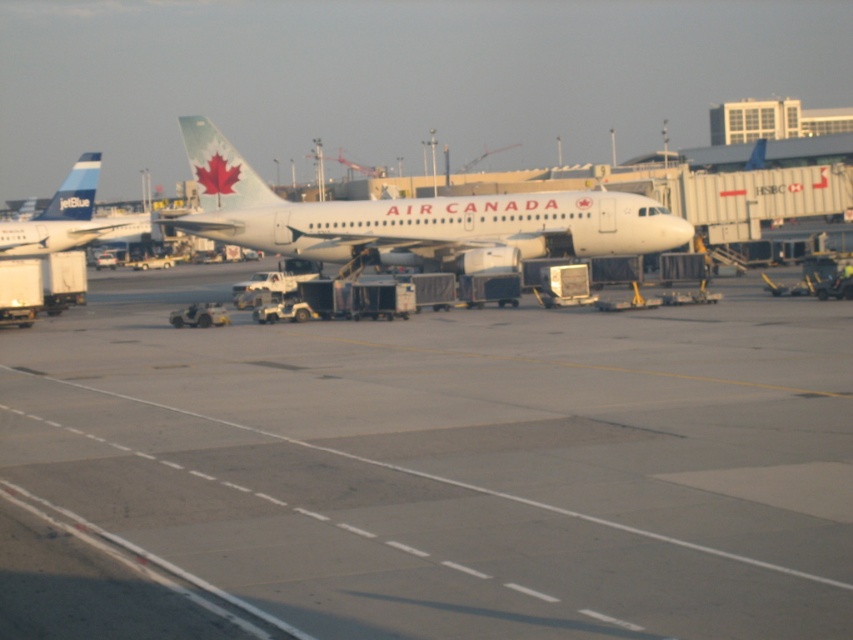
Question: Is white matte airplane at center smaller than matte blue airplane at left?

Choices:
 (A) no
 (B) yes

Answer: (A)

Question: Among these points, which one is nearest to the camera?

Choices:
 (A) (4, 234)
 (B) (640, 490)
 (C) (520, 224)

Answer: (B)

Question: Which point is closer to the camera?

Choices:
 (A) matte blue airplane at left
 (B) gray concrete tarmac at center

Answer: (B)

Question: Does gray concrete tarmac at center appear on the right side of matte blue airplane at left?

Choices:
 (A) yes
 (B) no

Answer: (A)

Question: Which point is closer to the camera taking this photo?

Choices:
 (A) (56, 212)
 (B) (90, 392)

Answer: (B)

Question: Considering the relative positions of white matte airplane at center and matte blue airplane at left in the image provided, where is white matte airplane at center located with respect to matte blue airplane at left?

Choices:
 (A) left
 (B) right

Answer: (B)